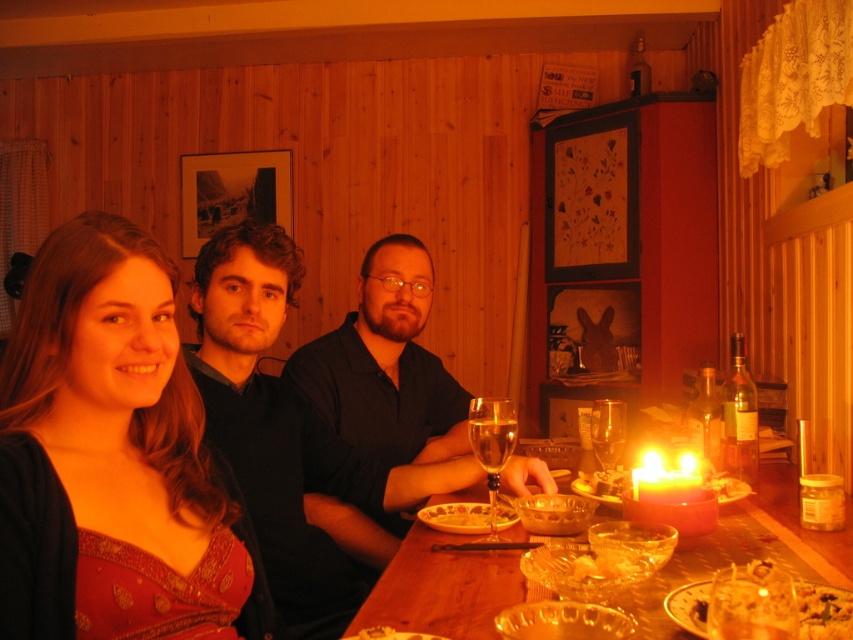
Does black matte shirt at center have a lesser width compared to translucent glass bowl at table center?

No.

Between point (405, 410) and point (604, 476), which one is positioned in front?

Point (604, 476)

I want to click on black matte shirt at center, so click(x=386, y=364).

Between translucent glass table at center and clear glass wine glass at center, which one is positioned higher?

Positioned higher is clear glass wine glass at center.

Who is more forward, (x=405, y=609) or (x=492, y=422)?

Positioned in front is point (x=405, y=609).

Is point (440, 612) in front of point (473, 429)?

That is True.

The image size is (853, 640). I want to click on translucent glass table at center, so click(x=442, y=588).

Does matte red dress at left have a greater width compared to clear glass wine glass at center?

Yes, matte red dress at left is wider than clear glass wine glass at center.

Can you confirm if matte red dress at left is positioned to the right of clear glass wine glass at center?

Incorrect, matte red dress at left is not on the right side of clear glass wine glass at center.

Who is more distant from viewer, (62,572) or (495,419)?

Point (495,419)

I want to click on matte red dress at left, so click(x=50, y=417).